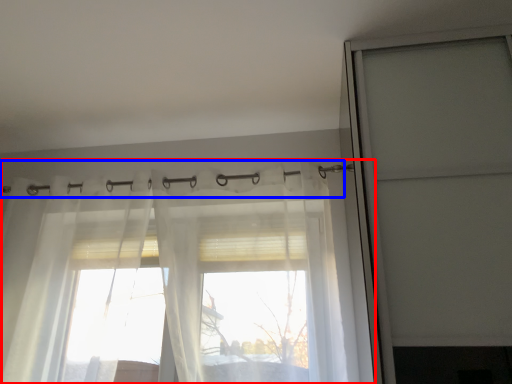
Question: Which object is further to the camera taking this photo, curtain (highlighted by a red box) or clothesline (highlighted by a blue box)?

Choices:
 (A) curtain
 (B) clothesline

Answer: (B)